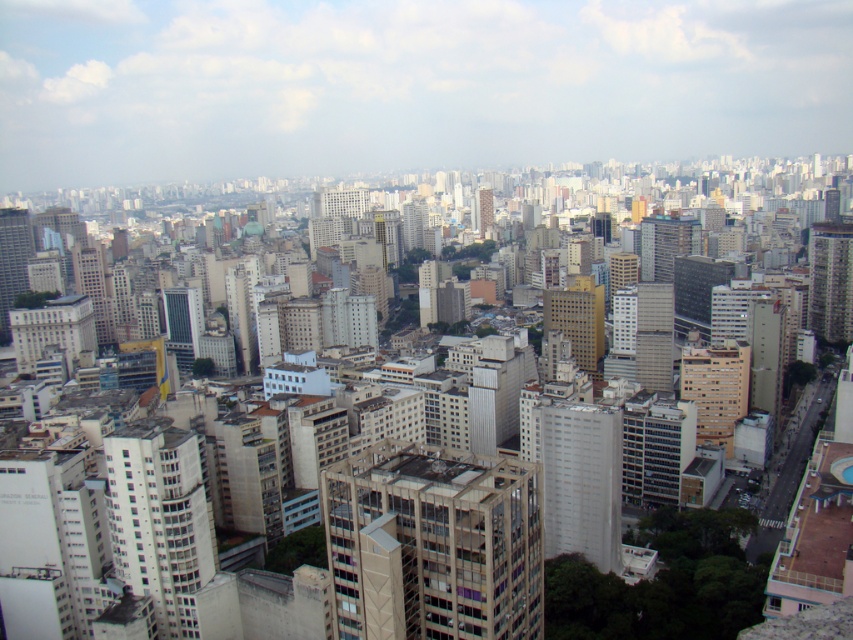
Question: Does matte glass skyscraper at left appear under smooth beige tower at center?

Choices:
 (A) no
 (B) yes

Answer: (B)

Question: Estimate the real-world distances between objects in this image. Which object is farther from the smooth beige tower at center?

Choices:
 (A) smooth gray building at right
 (B) white concrete building at lower left

Answer: (B)

Question: Is white concrete building at lower left wider than matte glass skyscraper at left?

Choices:
 (A) yes
 (B) no

Answer: (B)

Question: Which of the following is the farthest from the observer?

Choices:
 (A) (10, 248)
 (B) (480, 188)

Answer: (B)

Question: Does white concrete building at lower left appear under smooth gray building at right?

Choices:
 (A) yes
 (B) no

Answer: (A)

Question: Which is nearer to the white concrete building at lower left?

Choices:
 (A) beige concrete building at center
 (B) gold metallic building at center

Answer: (A)